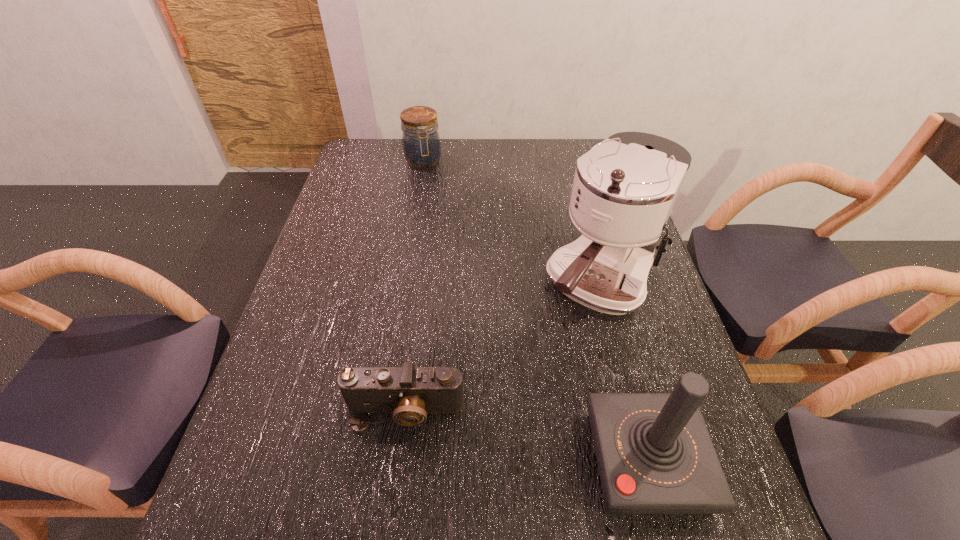
Where is `vacant point located between the shortest object and the farthest object`? This screenshot has width=960, height=540. vacant point located between the shortest object and the farthest object is located at coordinates (414, 287).

At what (x,y) coordinates should I click in order to perform the action: click on vacant area that lies between the camera and the second shortest object. Please return your answer as a coordinate pair (x, y). The image size is (960, 540). Looking at the image, I should click on (414, 287).

Select which object is the third closest to the third nearest object. Please provide its 2D coordinates. Your answer should be formatted as a tuple, i.e. [(x, y)], where the tuple contains the x and y coordinates of a point satisfying the conditions above.

[(421, 143)]

Image resolution: width=960 pixels, height=540 pixels. Find the location of `object identified as the third closest to the third tallest object`. object identified as the third closest to the third tallest object is located at coordinates (654, 453).

Locate an element on the screen. The width and height of the screenshot is (960, 540). free region that satisfies the following two spatial constraints: 1. on the front-facing side of the third shortest object; 2. on the rectangular base of the shortest object is located at coordinates (398, 461).